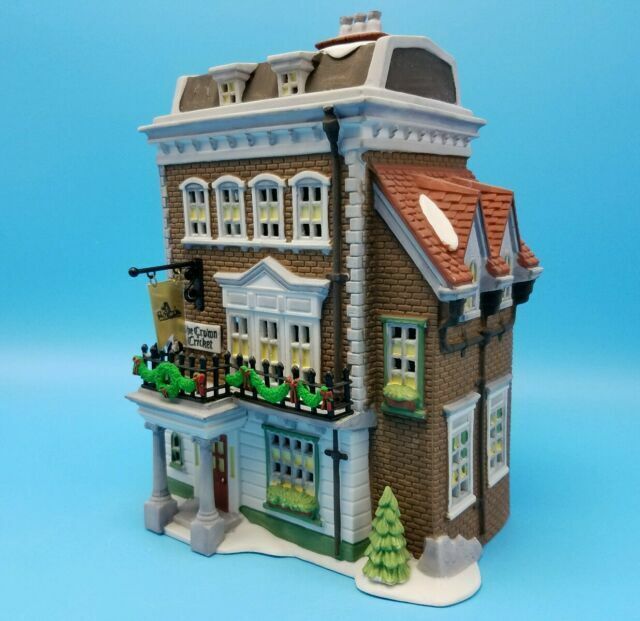
Locate an element on the screen. The width and height of the screenshot is (640, 621). brick wall is located at coordinates (408, 455), (313, 259), (452, 373).